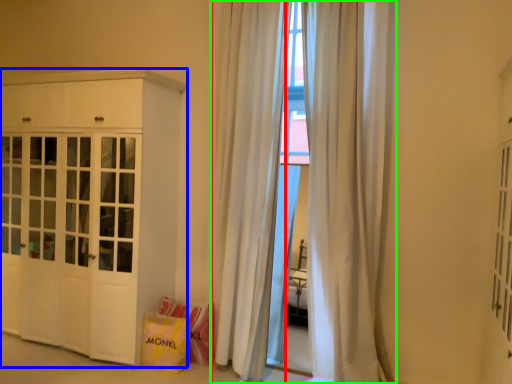
Question: Which object is the farthest from curtain (highlighted by a red box)? Choose among these: cabinetry (highlighted by a blue box) or curtain (highlighted by a green box).

Choices:
 (A) cabinetry
 (B) curtain

Answer: (A)